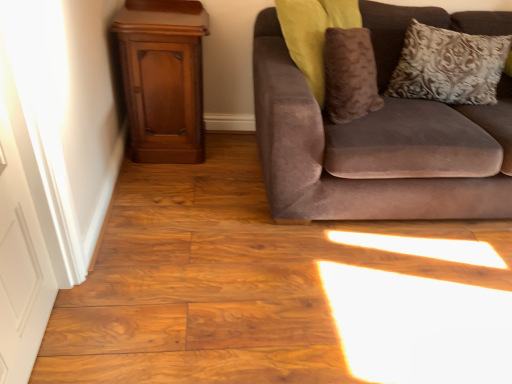
Question: Is mahogany wood dresser at left wider than silver textured pillow at upper right?

Choices:
 (A) no
 (B) yes

Answer: (B)

Question: Is mahogany wood dresser at left smaller than silver textured pillow at upper right?

Choices:
 (A) no
 (B) yes

Answer: (A)

Question: Does mahogany wood dresser at left appear on the left side of silver textured pillow at upper right?

Choices:
 (A) yes
 (B) no

Answer: (A)

Question: Considering the relative positions of mahogany wood dresser at left and silver textured pillow at upper right in the image provided, is mahogany wood dresser at left to the right of silver textured pillow at upper right from the viewer's perspective?

Choices:
 (A) no
 (B) yes

Answer: (A)

Question: From the image's perspective, does mahogany wood dresser at left appear lower than silver textured pillow at upper right?

Choices:
 (A) yes
 (B) no

Answer: (A)

Question: Considering the relative positions of suede couch at right and silver textured pillow at upper right in the image provided, is suede couch at right to the left or to the right of silver textured pillow at upper right?

Choices:
 (A) left
 (B) right

Answer: (A)

Question: From a real-world perspective, is suede couch at right positioned above or below silver textured pillow at upper right?

Choices:
 (A) below
 (B) above

Answer: (A)

Question: Considering the positions of suede couch at right and silver textured pillow at upper right in the image, is suede couch at right taller or shorter than silver textured pillow at upper right?

Choices:
 (A) tall
 (B) short

Answer: (A)

Question: Relative to silver textured pillow at upper right, is suede couch at right in front or behind?

Choices:
 (A) behind
 (B) front

Answer: (B)

Question: From their relative heights in the image, would you say mahogany wood dresser at left is taller or shorter than white painted wood door at left?

Choices:
 (A) short
 (B) tall

Answer: (A)

Question: In terms of width, does mahogany wood dresser at left look wider or thinner when compared to white painted wood door at left?

Choices:
 (A) wide
 (B) thin

Answer: (A)

Question: In the image, is mahogany wood dresser at left positioned in front of or behind white painted wood door at left?

Choices:
 (A) front
 (B) behind

Answer: (B)

Question: Based on their positions, is mahogany wood dresser at left located to the left or right of white painted wood door at left?

Choices:
 (A) right
 (B) left

Answer: (A)

Question: Is point (190, 21) positioned closer to the camera than point (403, 173)?

Choices:
 (A) farther
 (B) closer

Answer: (A)

Question: From a real-world perspective, relative to suede couch at right, is mahogany wood dresser at left vertically above or below?

Choices:
 (A) below
 (B) above

Answer: (A)